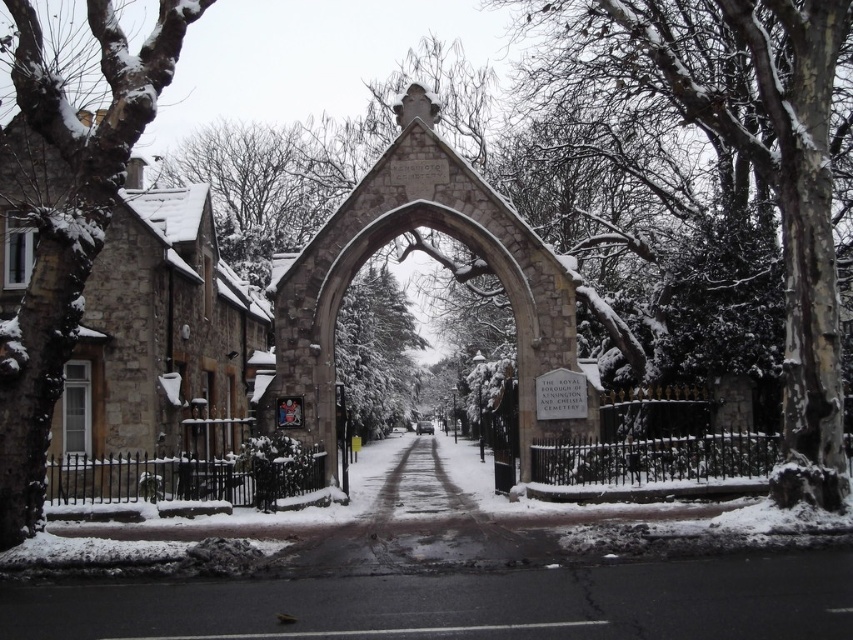
You are standing at the center of the archway and want to place a small snowman exactly at point (752, 164). Is there enough space to build it there?

The point (752, 164) is occupied by snow covered bark, so there is no space to build a snowman there.